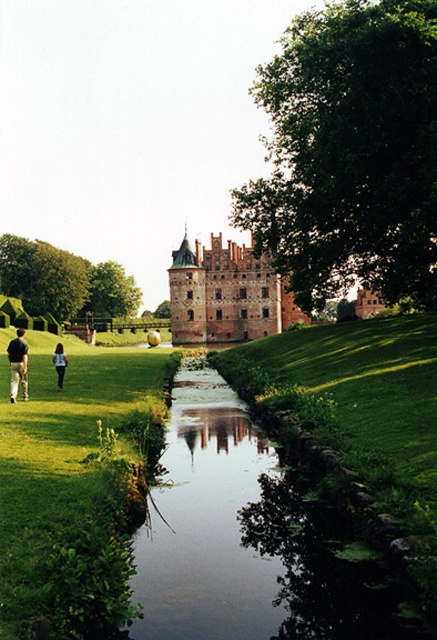
You are standing at the camera position and want to take a photo of the dark brown leather pants at lower left. Is the subject within your camera range if the maximum range is 100 meters?

The dark brown leather pants at lower left are 117.15 meters away from the camera, which exceeds the maximum range of 100 meters. Therefore, the subject is out of range and cannot be captured.

You are a tourist standing at the edge of the stream near the brown stone castle at center. You want to take a photo of the blue fabric backpack at lower left without the castle in the frame. Is this possible?

The brown stone castle at center is further to the viewer than the blue fabric backpack at lower left, so you can move closer to the blue fabric backpack at lower left and adjust your angle to exclude the castle from the photo.

Looking at this image, you are standing at the edge of a stream in front of a historic castle. You want to cross the stream to reach the castle. The stream is 10 meters wide. If you have a 12 meter long wooden plank, can you use it to safely cross the stream to the brown stone castle at center?

The brown stone castle at center is 163.53 meters away from the viewer. The stream is only 10 meters wide, so the 12 meter plank is sufficient to cross the stream. However, the distance to the castle is much greater, so the plank alone won not get you all the way to the brown stone castle at center.